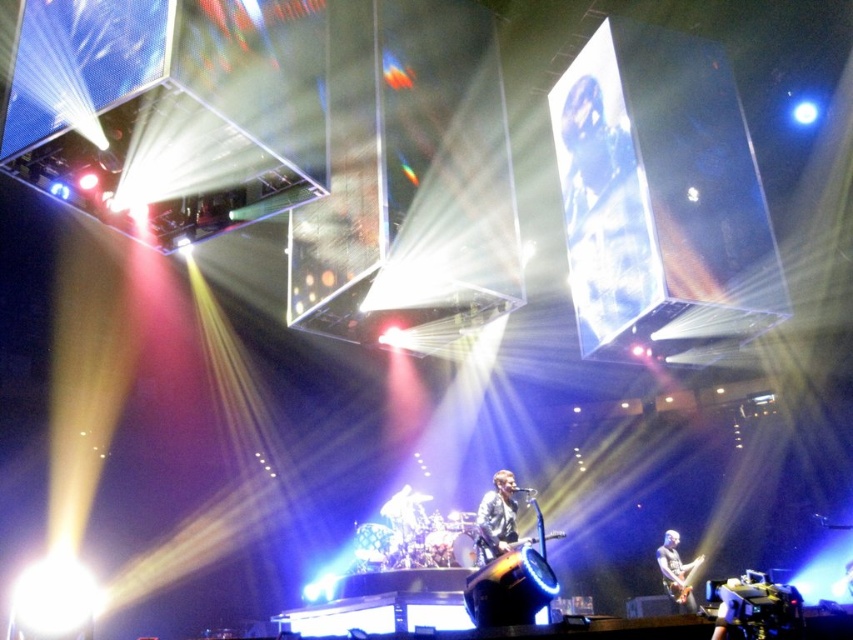
Question: Considering the real-world distances, which object is closest to the shiny black jacket at center?

Choices:
 (A) metallic silver guitar at lower right
 (B) shiny black guitar at lower right

Answer: (A)

Question: Is shiny black jacket at center wider than metallic silver guitar at lower right?

Choices:
 (A) yes
 (B) no

Answer: (B)

Question: Which is farther from the metallic silver guitar at lower right?

Choices:
 (A) shiny black guitar at lower right
 (B) shiny black jacket at center

Answer: (B)

Question: Can you confirm if shiny black jacket at center is positioned to the right of metallic silver guitar at lower right?

Choices:
 (A) no
 (B) yes

Answer: (A)

Question: Does shiny black guitar at lower right appear on the left side of metallic silver guitar at lower right?

Choices:
 (A) no
 (B) yes

Answer: (B)

Question: Which of these objects is positioned closest to the shiny black jacket at center?

Choices:
 (A) metallic silver guitar at lower right
 (B) shiny black guitar at lower right

Answer: (A)